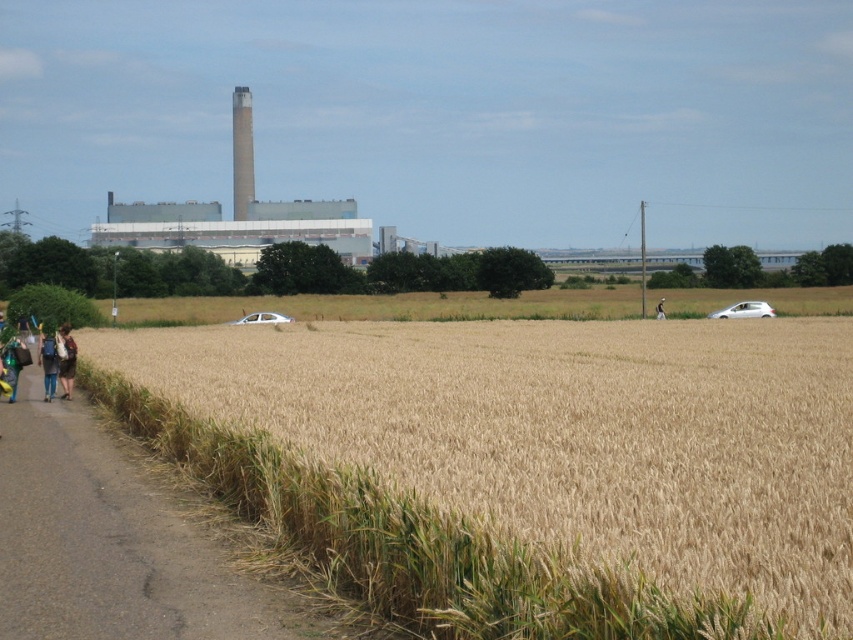
Question: Is golden wheat field at left positioned behind asphalt road at lower left?

Choices:
 (A) yes
 (B) no

Answer: (B)

Question: Which object appears farthest from the camera in this image?

Choices:
 (A) golden wheat field at left
 (B) asphalt road at lower left

Answer: (B)

Question: Among these points, which one is farthest from the camera?

Choices:
 (A) (32, 380)
 (B) (788, 596)

Answer: (A)

Question: Can you confirm if golden wheat field at left is positioned above asphalt road at lower left?

Choices:
 (A) no
 (B) yes

Answer: (B)

Question: Does golden wheat field at left have a lesser width compared to asphalt road at lower left?

Choices:
 (A) yes
 (B) no

Answer: (B)

Question: Which point appears closest to the camera in this image?

Choices:
 (A) (148, 604)
 (B) (788, 440)

Answer: (A)